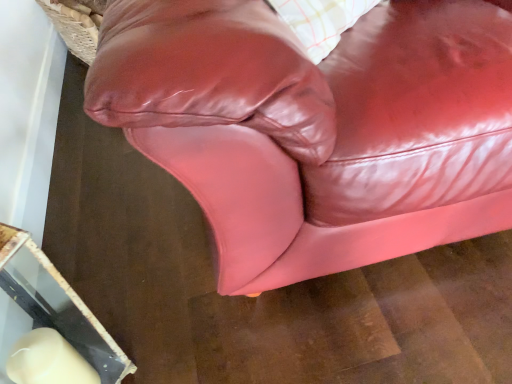
Measure the distance between glossy leather pillow at upper center and camera.

They are 19.92 inches apart.

Measure the distance between point (300, 114) and camera.

Point (300, 114) is 22.56 inches away from camera.

Identify the location of glossy leather pillow at upper center. This screenshot has height=384, width=512. (208, 74).

Image resolution: width=512 pixels, height=384 pixels. Describe the element at coordinates (208, 74) in the screenshot. I see `glossy leather pillow at upper center` at that location.

Image resolution: width=512 pixels, height=384 pixels. Identify the location of glossy leather couch at center. (316, 128).

The width and height of the screenshot is (512, 384). What do you see at coordinates (316, 128) in the screenshot?
I see `glossy leather couch at center` at bounding box center [316, 128].

Identify the location of glossy leather pillow at upper center. The height and width of the screenshot is (384, 512). (208, 74).

Considering the positions of objects glossy leather couch at center and glossy leather pillow at upper center in the image provided, who is more to the left, glossy leather couch at center or glossy leather pillow at upper center?

Positioned to the left is glossy leather couch at center.

Considering the relative positions of glossy leather couch at center and glossy leather pillow at upper center in the image provided, is glossy leather couch at center in front of glossy leather pillow at upper center?

No, glossy leather couch at center is behind glossy leather pillow at upper center.

Between point (325, 71) and point (306, 79), which one is positioned behind?

Positioned behind is point (325, 71).

From the image's perspective, is glossy leather couch at center located above glossy leather pillow at upper center?

No, from the image's perspective, glossy leather couch at center is not above glossy leather pillow at upper center.

From a real-world perspective, is glossy leather couch at center located higher than glossy leather pillow at upper center?

No, from a real-world perspective, glossy leather couch at center is not on top of glossy leather pillow at upper center.

Between glossy leather couch at center and glossy leather pillow at upper center, which one has smaller width?

glossy leather pillow at upper center is thinner.

Is glossy leather couch at center shorter than glossy leather pillow at upper center?

Yes, glossy leather couch at center is shorter than glossy leather pillow at upper center.

Based on their sizes in the image, would you say glossy leather couch at center is bigger or smaller than glossy leather pillow at upper center?

Clearly, glossy leather couch at center is larger in size than glossy leather pillow at upper center.

Choose the correct answer: Is glossy leather couch at center inside glossy leather pillow at upper center or outside it?

glossy leather couch at center is not enclosed by glossy leather pillow at upper center.

Is glossy leather couch at center not near glossy leather pillow at upper center?

They are positioned close to each other.

Is glossy leather couch at center oriented towards glossy leather pillow at upper center?

No.

Find the location of a particular element. studio couch lying on the left of glossy leather pillow at upper center is located at coordinates (316, 128).

Is glossy leather pillow at upper center to the left or to the right of glossy leather couch at center in the image?

In the image, glossy leather pillow at upper center appears on the right side of glossy leather couch at center.

Between glossy leather pillow at upper center and glossy leather couch at center, which one is positioned behind?

glossy leather couch at center is behind.

Is point (129, 33) farther from viewer compared to point (377, 58)?

That is False.

In the scene shown: From the image's perspective, is glossy leather pillow at upper center on top of glossy leather couch at center?

Yes.

From a real-world perspective, is glossy leather pillow at upper center on glossy leather couch at center?

Yes.

Considering the sizes of glossy leather pillow at upper center and glossy leather couch at center in the image, is glossy leather pillow at upper center wider or thinner than glossy leather couch at center?

In the image, glossy leather pillow at upper center appears to be more narrow than glossy leather couch at center.

Considering the sizes of objects glossy leather pillow at upper center and glossy leather couch at center in the image provided, who is shorter, glossy leather pillow at upper center or glossy leather couch at center?

Standing shorter between the two is glossy leather couch at center.

Considering the sizes of objects glossy leather pillow at upper center and glossy leather couch at center in the image provided, who is smaller, glossy leather pillow at upper center or glossy leather couch at center?

Smaller between the two is glossy leather pillow at upper center.

Is glossy leather pillow at upper center inside or outside of glossy leather couch at center?

glossy leather pillow at upper center is not enclosed by glossy leather couch at center.

Is glossy leather pillow at upper center not close to glossy leather couch at center?

glossy leather pillow at upper center is actually quite close to glossy leather couch at center.

Is glossy leather pillow at upper center looking in the opposite direction of glossy leather couch at center?

No.

How many degrees apart are the facing directions of glossy leather pillow at upper center and glossy leather couch at center?

The angle between the facing direction of glossy leather pillow at upper center and the facing direction of glossy leather couch at center is 50.2 degrees.

This screenshot has height=384, width=512. I want to click on pillow lying in front of the glossy leather couch at center, so click(x=208, y=74).

You are a GUI agent. You are given a task and a screenshot of the screen. Output one action in this format:
    pyautogui.click(x=<x>, y=<y>)
    Task: Click on the pillow above the glossy leather couch at center (from the image's perspective)
    
    Given the screenshot: What is the action you would take?
    pyautogui.click(x=208, y=74)

The width and height of the screenshot is (512, 384). In order to click on pillow that appears in front of the glossy leather couch at center in this screenshot , I will do `click(208, 74)`.